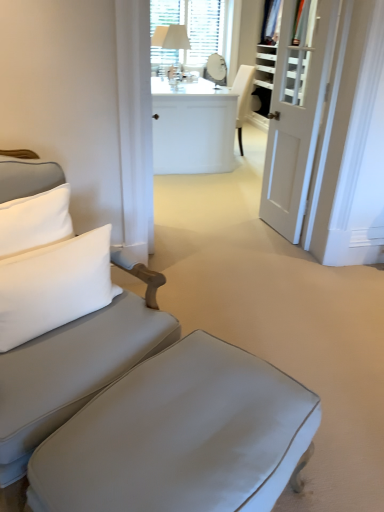
Question: Is matte gray ottoman at lower center taller than white textured mirror at upper center?

Choices:
 (A) yes
 (B) no

Answer: (B)

Question: Is white textured mirror at upper center located within matte gray ottoman at lower center?

Choices:
 (A) no
 (B) yes

Answer: (A)

Question: Are matte gray ottoman at lower center and white textured mirror at upper center located far from each other?

Choices:
 (A) yes
 (B) no

Answer: (A)

Question: Is matte gray ottoman at lower center facing away from white textured mirror at upper center?

Choices:
 (A) yes
 (B) no

Answer: (B)

Question: Considering the relative positions of matte gray ottoman at lower center and white textured mirror at upper center in the image provided, is matte gray ottoman at lower center to the right of white textured mirror at upper center from the viewer's perspective?

Choices:
 (A) no
 (B) yes

Answer: (A)

Question: From their relative heights in the image, would you say matte gray ottoman at lower center is taller or shorter than white fabric table lamp at upper center?

Choices:
 (A) short
 (B) tall

Answer: (A)

Question: Does point (87, 472) appear closer or farther from the camera than point (178, 25)?

Choices:
 (A) farther
 (B) closer

Answer: (B)

Question: In terms of width, does matte gray ottoman at lower center look wider or thinner when compared to white fabric table lamp at upper center?

Choices:
 (A) thin
 (B) wide

Answer: (B)

Question: From the image's perspective, is matte gray ottoman at lower center located above or below white fabric table lamp at upper center?

Choices:
 (A) above
 (B) below

Answer: (B)

Question: From a real-world perspective, is white glossy desk at center physically located above or below white textured mirror at upper center?

Choices:
 (A) below
 (B) above

Answer: (A)

Question: Considering the positions of white glossy desk at center and white textured mirror at upper center in the image, is white glossy desk at center taller or shorter than white textured mirror at upper center?

Choices:
 (A) short
 (B) tall

Answer: (A)

Question: Would you say white glossy desk at center is to the left or to the right of white textured mirror at upper center in the picture?

Choices:
 (A) left
 (B) right

Answer: (A)

Question: Is white glossy desk at center inside the boundaries of white textured mirror at upper center, or outside?

Choices:
 (A) outside
 (B) inside

Answer: (A)

Question: Based on their sizes in the image, would you say white glossy desk at center is bigger or smaller than matte gray fabric couch at left?

Choices:
 (A) small
 (B) big

Answer: (B)

Question: From the image's perspective, is white glossy desk at center located above or below matte gray fabric couch at left?

Choices:
 (A) below
 (B) above

Answer: (B)